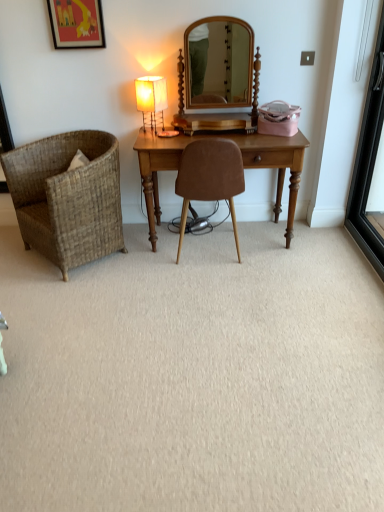
This screenshot has height=512, width=384. I want to click on vacant area in front of matte fabric table lamp at center, so click(x=163, y=135).